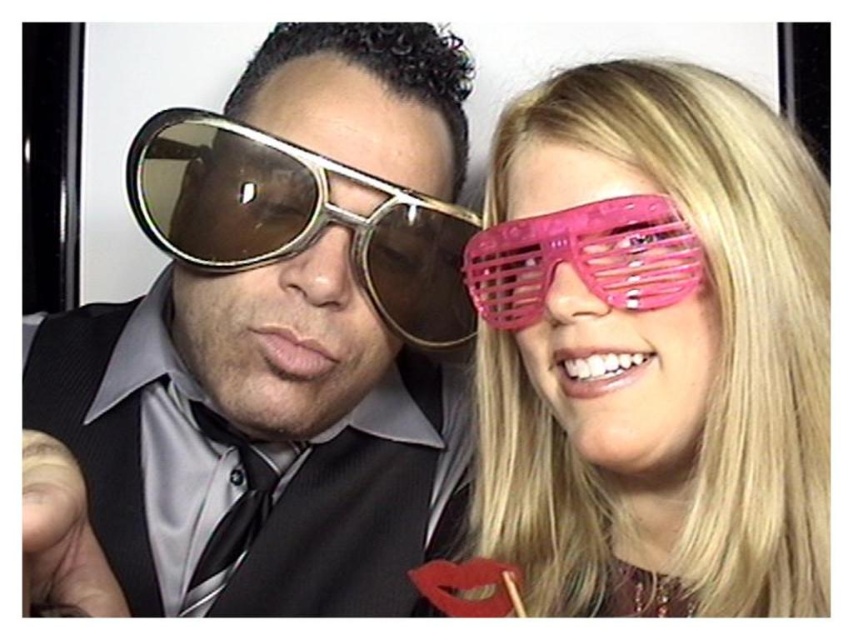
You are designing a display case for sunglasses. The case has two compartments. The first compartment is 10 cm wide, and the second is 8 cm wide. You need to place the metallic gold sunglasses at left and the pink plastic glasses at right into the compartments. Based on their widths, which sunglasses should go into which compartment?

The metallic gold sunglasses at left are wider than the pink plastic glasses at right, so the metallic gold sunglasses at left should go into the 10 cm wide compartment, and the pink plastic glasses at right should go into the 8 cm wide compartment.

You are a photographer trying to capture a closeup shot of the metallic gold sunglasses at left and the gold reflective sunglasses at left. Which pair should you focus on first to ensure they are in sharp focus?

The metallic gold sunglasses at left is closer to the viewer than the gold reflective sunglasses at left, so you should focus on the metallic gold sunglasses at left first to ensure they are in sharp focus.